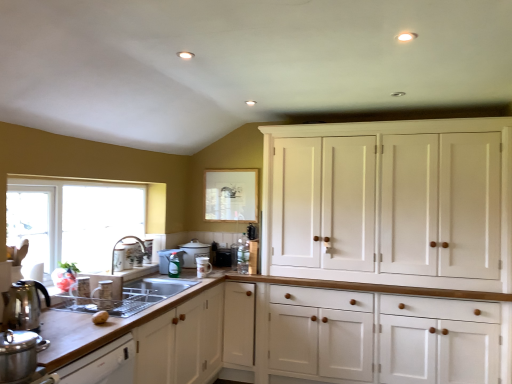
Find the location of `vacant space positioned to the left of matte white cup at sink, which is the 5th appliance in back-to-front order`. vacant space positioned to the left of matte white cup at sink, which is the 5th appliance in back-to-front order is located at coordinates (68, 306).